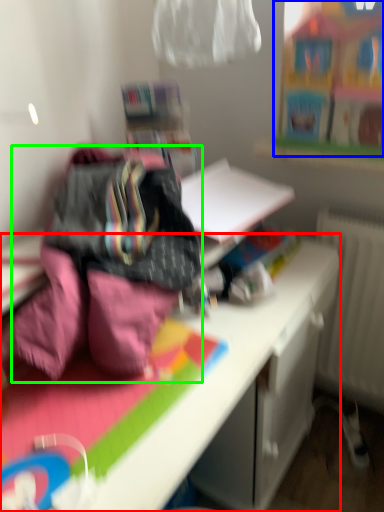
Question: Which is farther away from desk (highlighted by a red box)? toy (highlighted by a blue box) or bedding (highlighted by a green box)?

Choices:
 (A) toy
 (B) bedding

Answer: (A)